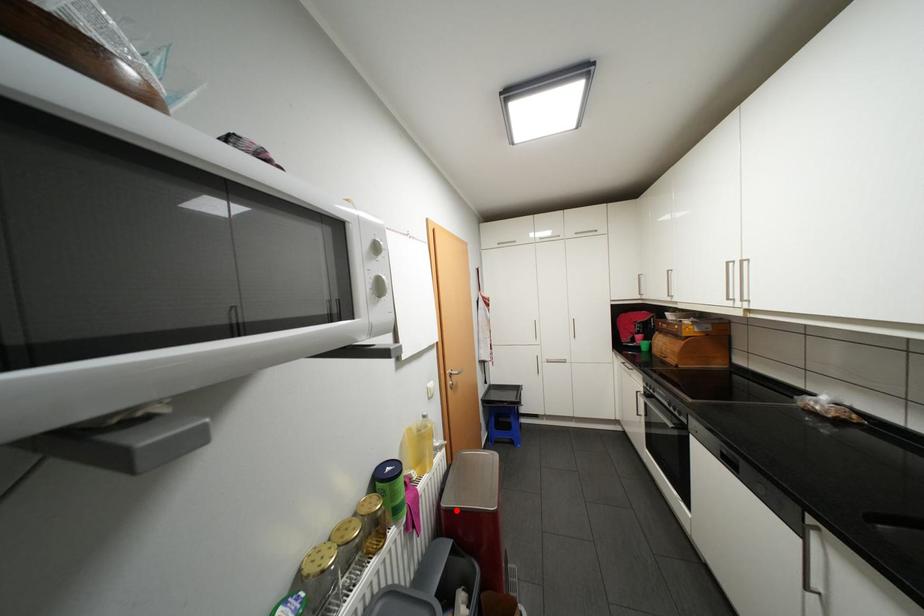
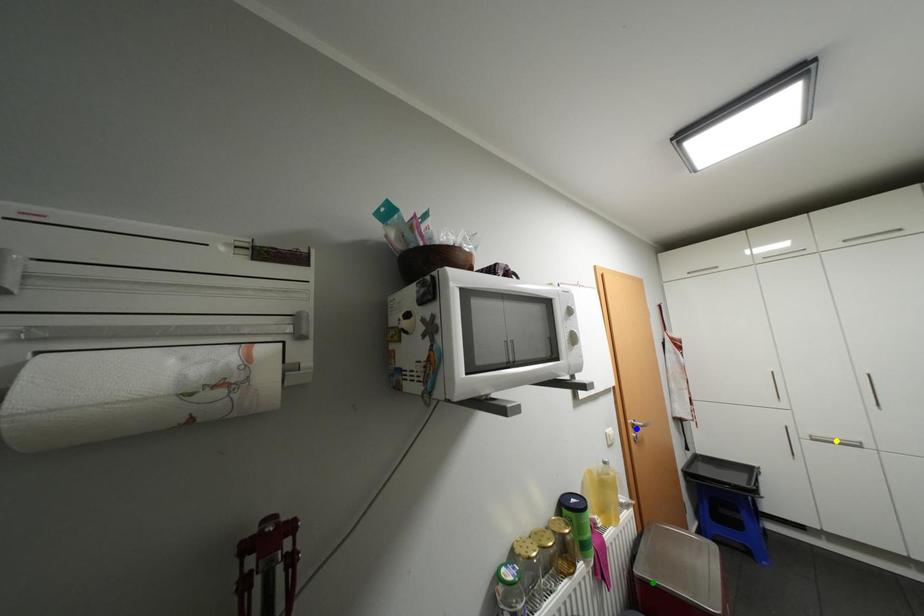
Question: I am providing you with two images of the same scene from different viewpoints. A red point is marked on the first image. You are given multiple points on the second image. In image 2, which mark is for the same physical point as the one in image 1?

Choices:
 (A) blue point
 (B) green point
 (C) yellow point

Answer: (B)